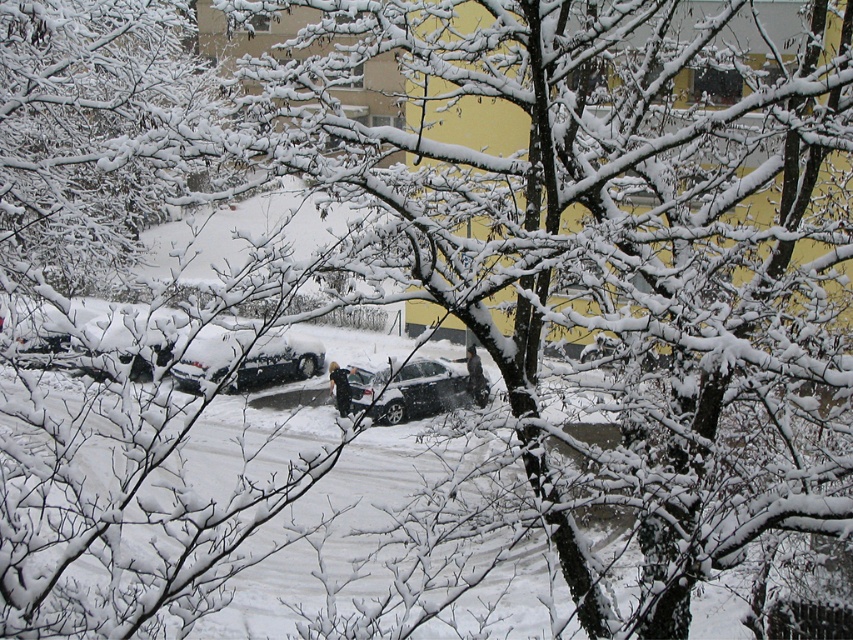
Which is above, sleek black car at center or satin silver sedan at center?

sleek black car at center

Is sleek black car at center to the left of satin silver sedan at center from the viewer's perspective?

Indeed, sleek black car at center is positioned on the left side of satin silver sedan at center.

Where is `sleek black car at center`? Image resolution: width=853 pixels, height=640 pixels. sleek black car at center is located at coordinates (247, 358).

I want to click on sleek black car at center, so click(247, 358).